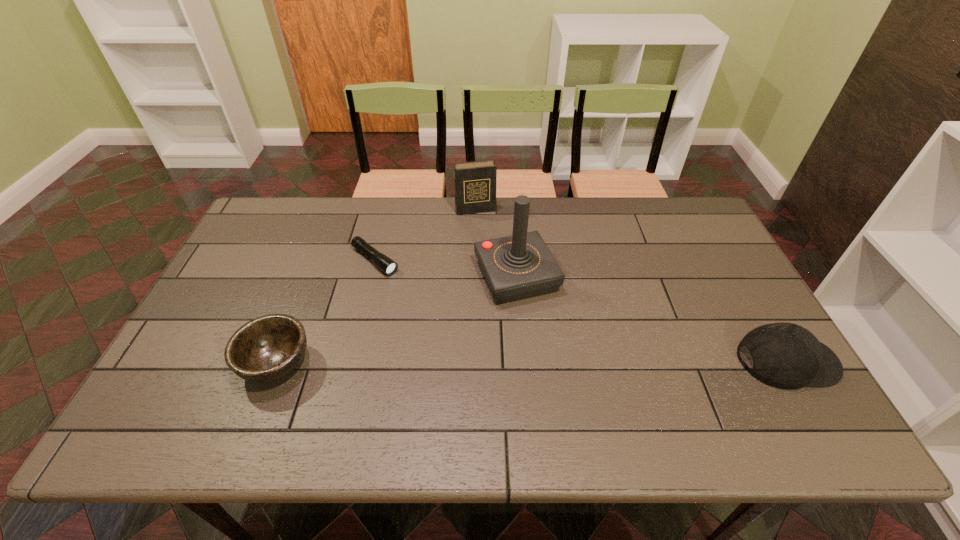
Find the location of a particular element. vacant space in between the leftmost object and the shortest object is located at coordinates (325, 312).

The image size is (960, 540). Identify the location of vacant space that's between the farthest object and the flashlight. (425, 235).

Identify the location of empty space that is in between the cap and the fourth shortest object. The image size is (960, 540). (632, 286).

Where is `empty location between the second shortest object and the shortest object`? This screenshot has height=540, width=960. empty location between the second shortest object and the shortest object is located at coordinates (325, 312).

Identify the location of vacant point located between the shortest object and the joystick. The height and width of the screenshot is (540, 960). (445, 268).

This screenshot has height=540, width=960. Identify the location of free area in between the rightmost object and the farthest object. (632, 286).

What are the coordinates of `vacant space in between the fourth shortest object and the second shortest object` in the screenshot? It's located at (376, 286).

Where is `empty space between the rightmost object and the diary`? The width and height of the screenshot is (960, 540). empty space between the rightmost object and the diary is located at coordinates (632, 286).

Locate an element on the screen. free spot between the rightmost object and the farthest object is located at coordinates (632, 286).

Identify which object is the third nearest to the farthest object. Please provide its 2D coordinates. Your answer should be formatted as a tuple, i.e. [(x, y)], where the tuple contains the x and y coordinates of a point satisfying the conditions above.

[(267, 348)]